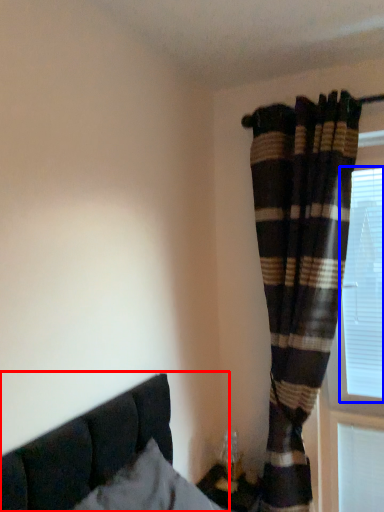
Question: Which point is closer to the camera, bed (highlighted by a red box) or bay window (highlighted by a blue box)?

Choices:
 (A) bed
 (B) bay window

Answer: (A)